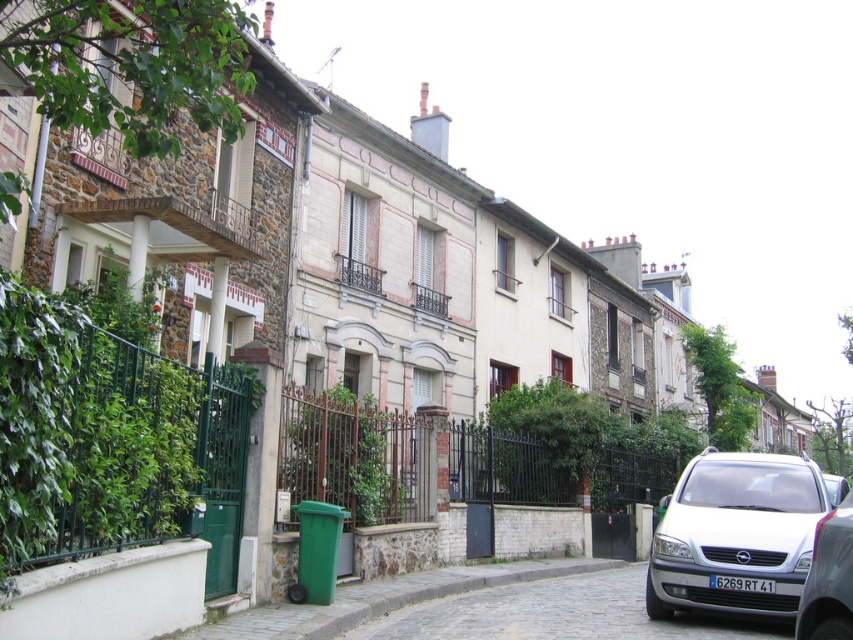
Who is taller, white matte van at lower right or silver metallic van at right?

Standing taller between the two is white matte van at lower right.

Does white matte van at lower right have a lesser height compared to silver metallic van at right?

Incorrect, white matte van at lower right's height does not fall short of silver metallic van at right's.

Which is in front, point (759, 554) or point (830, 637)?

Point (830, 637) is more forward.

Locate an element on the screen. The image size is (853, 640). white matte van at lower right is located at coordinates (735, 536).